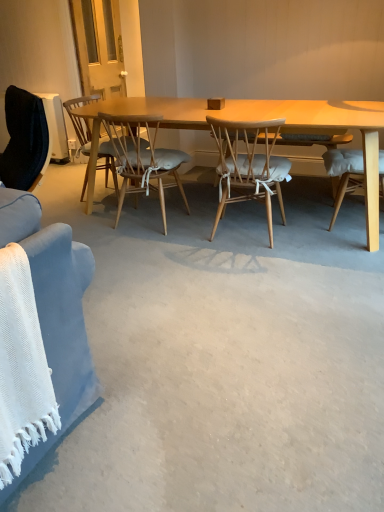
You are a GUI agent. You are given a task and a screenshot of the screen. Output one action in this format:
    pyautogui.click(x=<x>, y=<y>)
    Task: Click on the vacant space that is to the left of light brown wood chair at center, which ranks as the 2th chair in left-to-right order
    
    Given the screenshot: What is the action you would take?
    pyautogui.click(x=94, y=220)